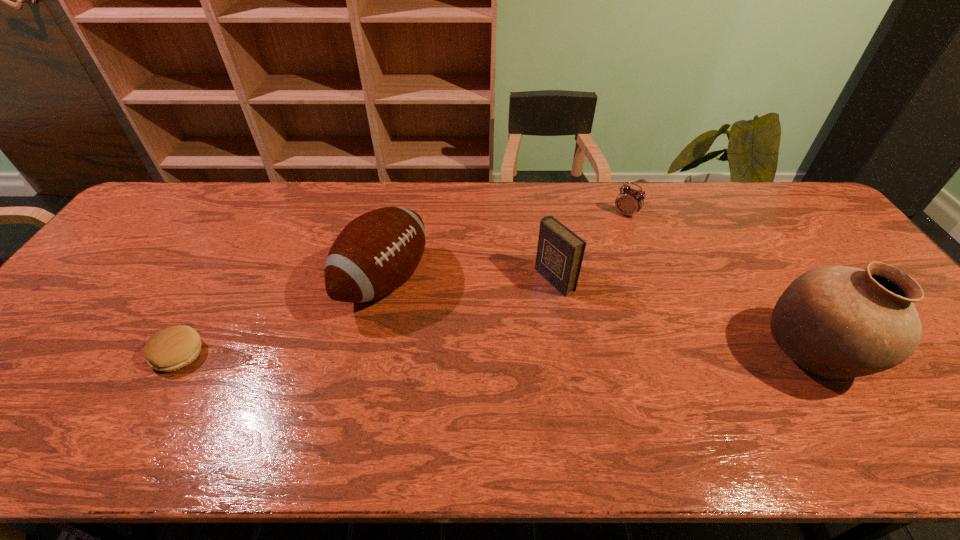
Identify the location of the leftmost object. (171, 348).

This screenshot has width=960, height=540. In order to click on patty in this screenshot , I will do `click(171, 348)`.

This screenshot has height=540, width=960. Find the location of `the tallest object`. the tallest object is located at coordinates (838, 322).

Find the location of `pottery`. pottery is located at coordinates (838, 322).

Locate an element on the screen. This screenshot has width=960, height=540. the fourth object from right to left is located at coordinates (376, 253).

The width and height of the screenshot is (960, 540). I want to click on the fourth shortest object, so click(376, 253).

Find the location of a particular element. The height and width of the screenshot is (540, 960). the third object from right to left is located at coordinates (560, 252).

Image resolution: width=960 pixels, height=540 pixels. I want to click on diary, so click(560, 252).

I want to click on alarm clock, so click(x=629, y=201).

In order to click on the farthest object in this screenshot , I will do `click(629, 201)`.